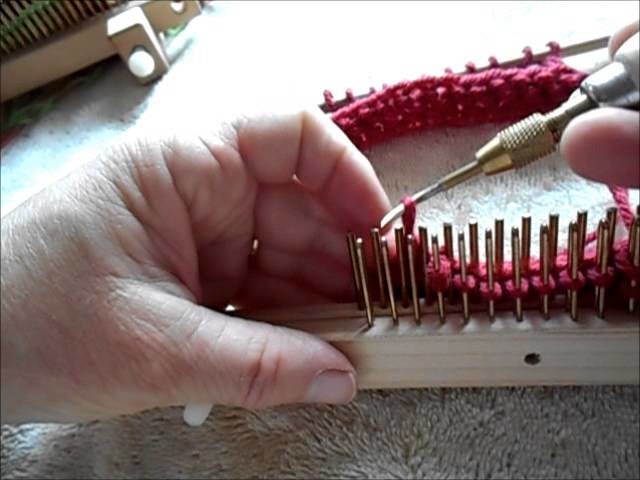
This screenshot has height=480, width=640. What are the coordinates of `bracket` in the screenshot? It's located at (64, 61).